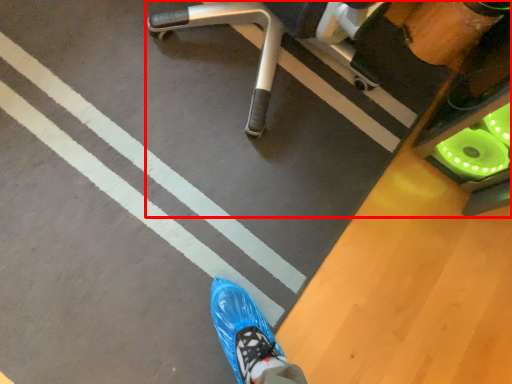
Question: From the image's perspective, considering the relative positions of furniture (annotated by the red box) and strip in the image provided, where is furniture (annotated by the red box) located with respect to the staircase?

Choices:
 (A) below
 (B) above

Answer: (B)